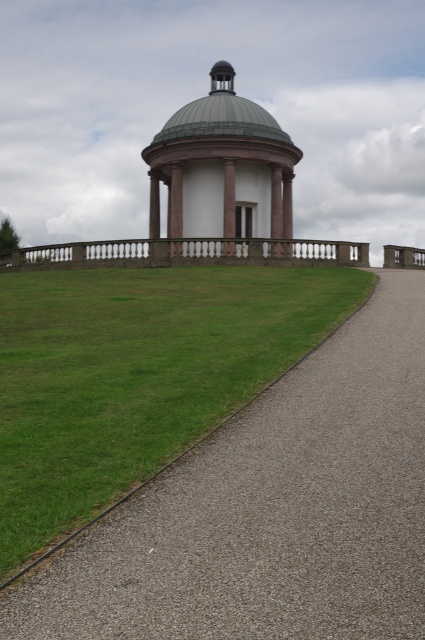
You are standing at the base of the grassy hill and want to reach the classical pavilion. Which direction should you walk to follow the gray gravel driveway at center?

The gray gravel driveway at center is located at point (269, 512), so you should walk towards the center of the image to follow the driveway towards the pavilion.

You are standing at the base of the grassy hill and want to reach the classical pavilion. According to the image, which direction should you walk to follow the gray gravel driveway at center indicated by point (269,512)?

The gray gravel driveway at center indicated by point (269,512) is located at the center of the image, so you should walk towards the center to follow it toward the pavilion.